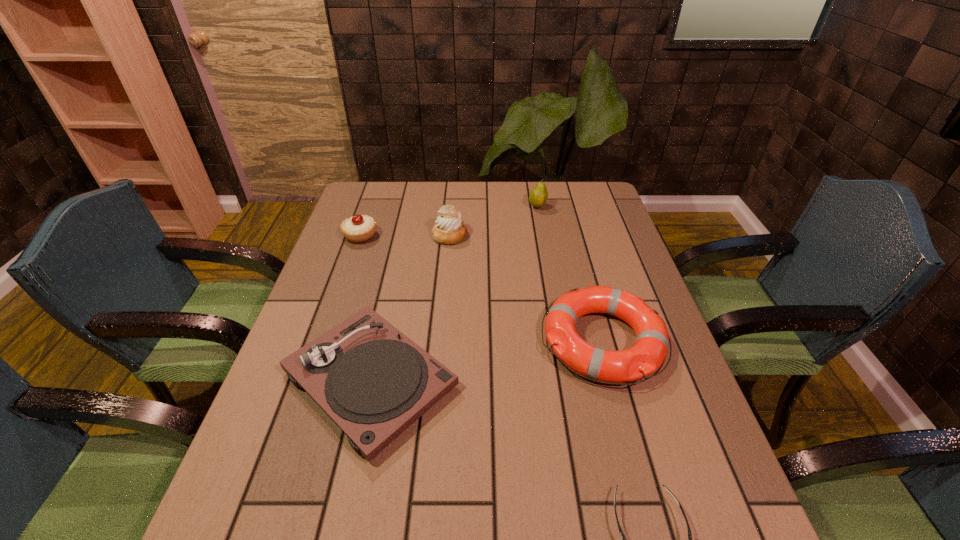
Locate an element on the screen. Image resolution: width=960 pixels, height=540 pixels. the farthest object is located at coordinates (538, 196).

Identify the location of the right pastry. (449, 229).

You are a GUI agent. You are given a task and a screenshot of the screen. Output one action in this format:
    pyautogui.click(x=<x>, y=<y>)
    Task: Click on the shorter pastry
    This screenshot has width=960, height=540.
    Given the screenshot: What is the action you would take?
    pyautogui.click(x=358, y=228)

At what (x,y) coordinates should I click in order to perform the action: click on phonograph_record. Please return your answer as a coordinate pair (x, y). This screenshot has height=540, width=960. Looking at the image, I should click on (374, 382).

The height and width of the screenshot is (540, 960). In order to click on life buoy in this screenshot , I will do `click(648, 353)`.

This screenshot has height=540, width=960. Identify the location of vacant region located on the front of the farthest object. (548, 264).

This screenshot has width=960, height=540. In order to click on blank space located on the front of the right pastry in this screenshot , I will do `click(448, 256)`.

This screenshot has height=540, width=960. What are the coordinates of `free space located on the back of the left pastry` in the screenshot? It's located at (375, 192).

The image size is (960, 540). I want to click on free space located 0.280m on the back of the phonograph_record, so click(399, 250).

Identify the location of free location located on the front of the life buoy. The height and width of the screenshot is (540, 960). (658, 539).